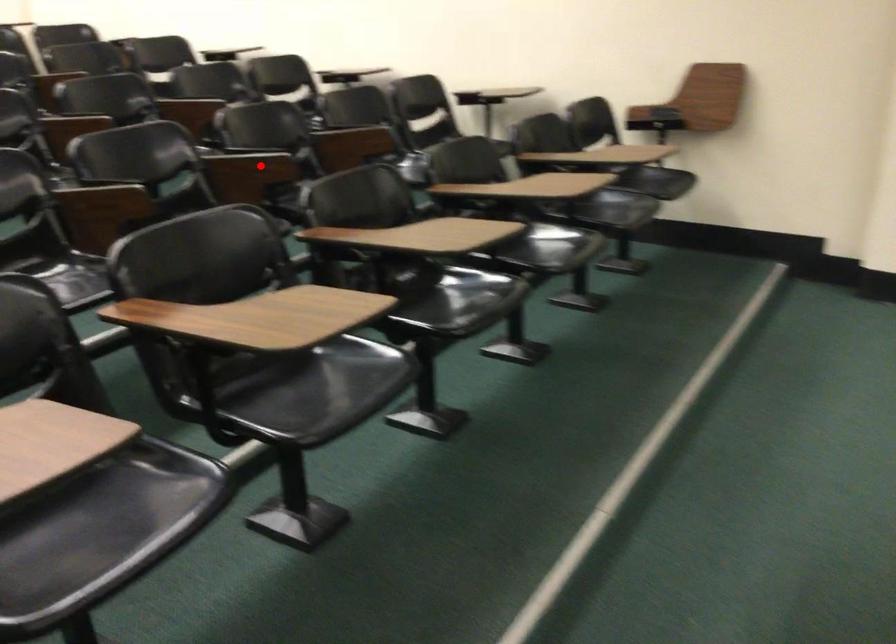
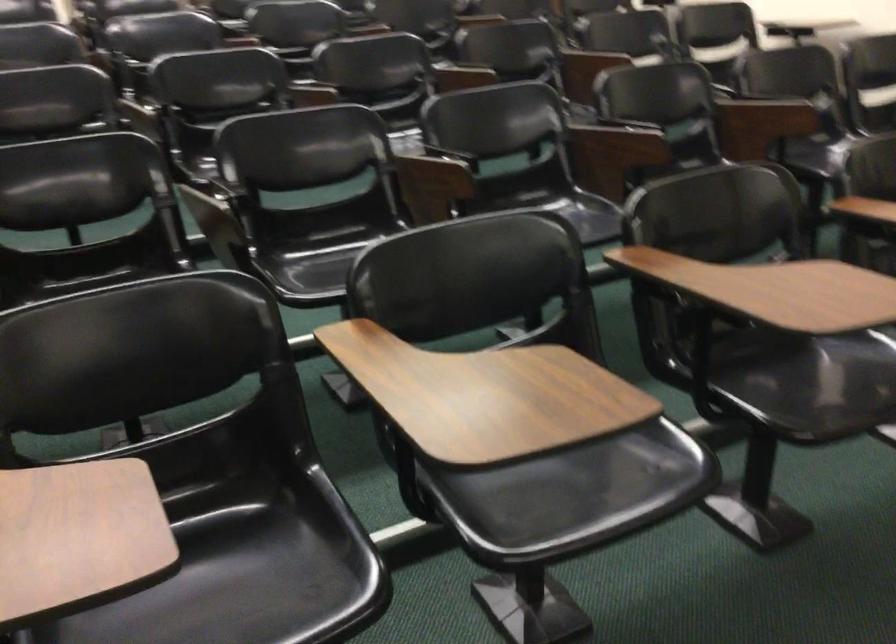
Locate, in the second image, the point that corresponds to the highlighted location in the first image.

(615, 140)